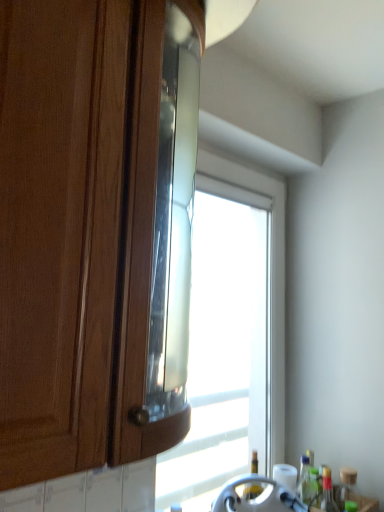
Question: Does matte wood cabinet at left come behind transparent glass bottle at lower right, placed as the third bottle when sorted from right to left?

Choices:
 (A) no
 (B) yes

Answer: (A)

Question: Is matte wood cabinet at left oriented away from transparent glass bottle at lower right, placed as the 1th bottle when sorted from left to right?

Choices:
 (A) no
 (B) yes

Answer: (A)

Question: Considering the relative sizes of matte wood cabinet at left and transparent glass bottle at lower right, placed as the 1th bottle when sorted from left to right, in the image provided, is matte wood cabinet at left bigger than transparent glass bottle at lower right, placed as the 1th bottle when sorted from left to right,?

Choices:
 (A) no
 (B) yes

Answer: (B)

Question: Is matte wood cabinet at left completely or partially outside of transparent glass bottle at lower right, placed as the 1th bottle when sorted from left to right?

Choices:
 (A) no
 (B) yes

Answer: (B)

Question: Could you tell me if matte wood cabinet at left is turned towards transparent glass bottle at lower right, placed as the 1th bottle when sorted from left to right?

Choices:
 (A) no
 (B) yes

Answer: (A)

Question: Considering the positions of transparent glass window at center and translucent plastic bottle at lower right, the second bottle viewed from the right, in the image, is transparent glass window at center bigger or smaller than translucent plastic bottle at lower right, the second bottle viewed from the right,?

Choices:
 (A) big
 (B) small

Answer: (A)

Question: Does point (240, 292) appear closer or farther from the camera than point (329, 488)?

Choices:
 (A) closer
 (B) farther

Answer: (B)

Question: From a real-world perspective, is transparent glass window at center physically located above or below translucent plastic bottle at lower right, the second bottle viewed from the right?

Choices:
 (A) below
 (B) above

Answer: (B)

Question: In the image, is transparent glass window at center positioned in front of or behind translucent plastic bottle at lower right, the second bottle viewed from the right?

Choices:
 (A) behind
 (B) front

Answer: (B)

Question: Is point (132, 253) closer or farther from the camera than point (241, 467)?

Choices:
 (A) closer
 (B) farther

Answer: (A)

Question: Looking at their shapes, would you say matte wood cabinet at left is wider or thinner than transparent glass window at center?

Choices:
 (A) wide
 (B) thin

Answer: (A)

Question: From their relative heights in the image, would you say matte wood cabinet at left is taller or shorter than transparent glass window at center?

Choices:
 (A) short
 (B) tall

Answer: (A)

Question: Choose the correct answer: Is matte wood cabinet at left inside transparent glass window at center or outside it?

Choices:
 (A) inside
 (B) outside

Answer: (B)

Question: Is point (347, 489) positioned closer to the camera than point (244, 170)?

Choices:
 (A) farther
 (B) closer

Answer: (B)

Question: Considering their positions, is translucent glass bottle at lower right, the 3th bottle positioned from the left, located in front of or behind transparent glass window at center?

Choices:
 (A) front
 (B) behind

Answer: (B)